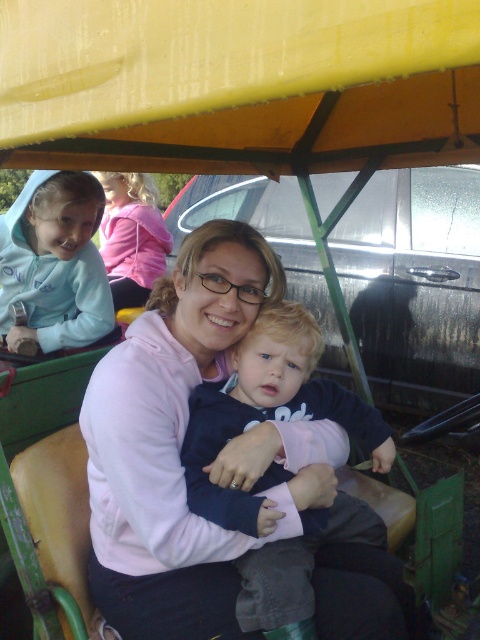
You are helping organize jackets in a storage area. You have two jackets, the light blue fleece jacket at upper left and the pink fleece jacket at upper left. If you need to place them side by side on a shelf, which jacket will require more horizontal space?

The light blue fleece jacket at upper left requires more horizontal space because its width is larger than the pink fleece jacket at upper left.

You are a fashion designer observing the scene and want to create a new line of clothing based on the items seen. Which item, the dark blue fleece at center or the light blue fleece jacket at upper left, would you choose if you want to focus on a larger size for your collection?

The dark blue fleece at center is larger in size than the light blue fleece jacket at upper left, so you should choose the dark blue fleece at center for the larger size in your collection.

In the scene shown: You are helping organize a clothing donation drive and need to stack the dark blue fleece at center and the pink fleece jacket at upper left. If you want to place the shorter item on top to make the stack more stable, which item should you put on top?

The dark blue fleece at center has a lesser height compared to the pink fleece jacket at upper left, so you should place the dark blue fleece at center on top to create a stable stack.